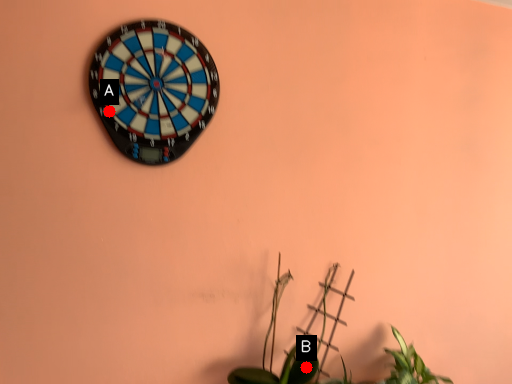
Question: Two points are circled on the image, labeled by A and B beside each circle. Which point appears closest to the camera in this image?

Choices:
 (A) A is closer
 (B) B is closer

Answer: (A)